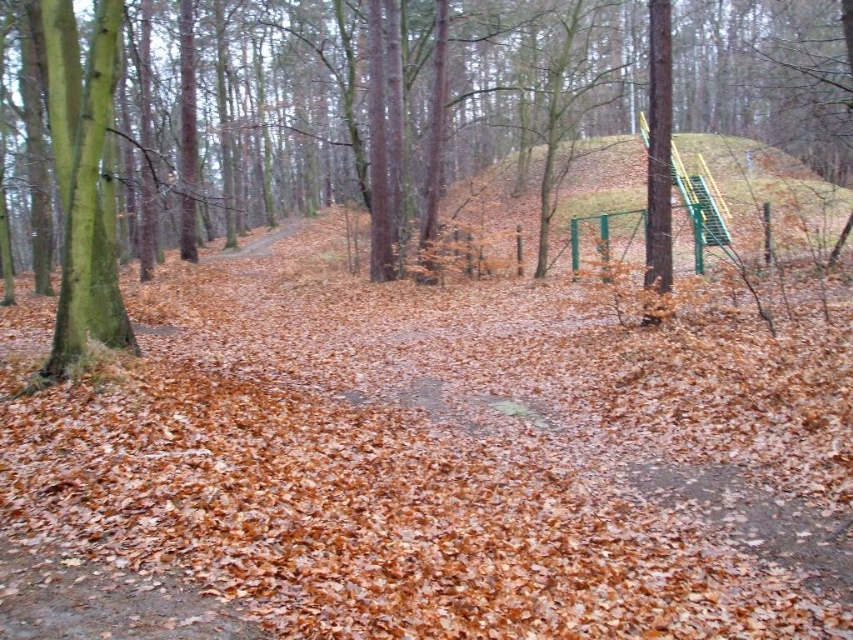
Question: Does brown leaf litter at upper center appear under green textured tree at center?

Choices:
 (A) yes
 (B) no

Answer: (A)

Question: Does green textured tree at center appear over green grassy hillside at upper right?

Choices:
 (A) no
 (B) yes

Answer: (B)

Question: Which object appears farthest from the camera in this image?

Choices:
 (A) green grassy hillside at upper right
 (B) green rough bark tree at left
 (C) brown leaf litter at upper center

Answer: (A)

Question: Estimate the real-world distances between objects in this image. Which object is farther from the green rough bark tree at left?

Choices:
 (A) green textured tree at center
 (B) green grassy hillside at upper right

Answer: (A)

Question: Which is farther from the green metallic slide at upper right?

Choices:
 (A) brown leaf litter at upper center
 (B) green textured tree at center
 (C) green rough bark tree at left
 (D) green grassy hillside at upper right

Answer: (C)

Question: Does green grassy hillside at upper right appear on the right side of green rough bark tree at left?

Choices:
 (A) yes
 (B) no

Answer: (A)